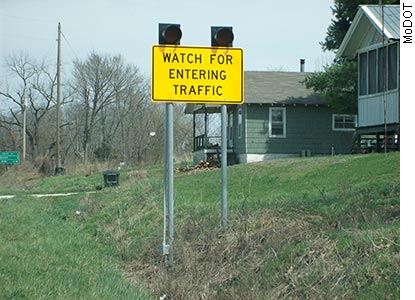
At what (x,y) coordinates should I click in order to perform the action: click on window. Please return your answer as a coordinate pair (x, y). Looking at the image, I should click on [278, 127], [346, 121].